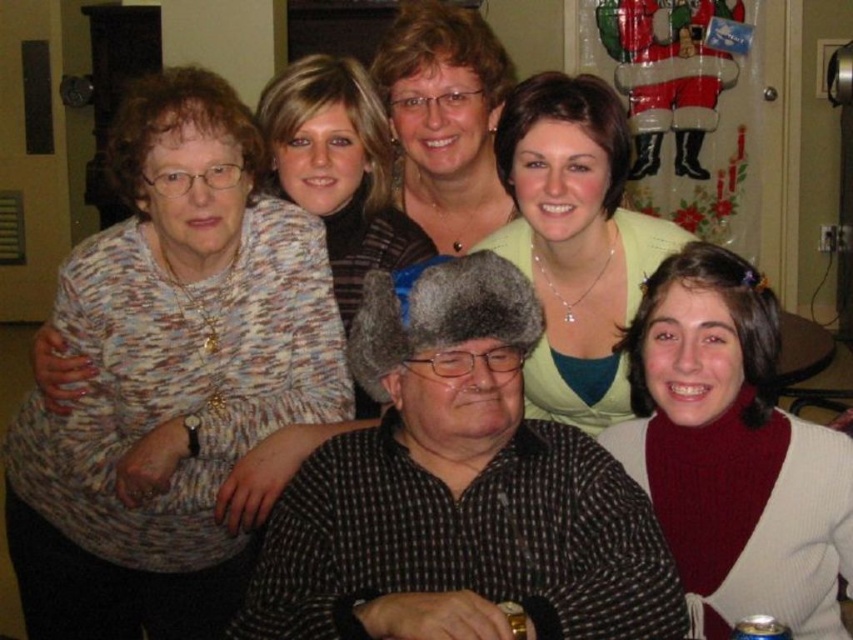
Question: Is checkered fabric shirt at center positioned in front of knitted sweater at upper center?

Choices:
 (A) no
 (B) yes

Answer: (B)

Question: Based on their relative distances, which object is farther from the knitted red sweater at lower right?

Choices:
 (A) checkered fabric shirt at center
 (B) light green fabric shirt at center
 (C) speckled knit sweater at upper left

Answer: (C)

Question: Does speckled knit sweater at upper left have a greater width compared to checkered fabric shirt at center?

Choices:
 (A) yes
 (B) no

Answer: (A)

Question: Which point appears closest to the camera in this image?

Choices:
 (A) pos(285,323)
 (B) pos(468,93)
 (C) pos(294,76)
 (D) pos(675,348)

Answer: (D)

Question: Which of these objects is positioned farthest from the checkered fabric shirt at center?

Choices:
 (A) knitted sweater at upper center
 (B) matte black sweater at upper center

Answer: (B)

Question: Does matte black sweater at upper center appear under knitted sweater at upper center?

Choices:
 (A) no
 (B) yes

Answer: (A)